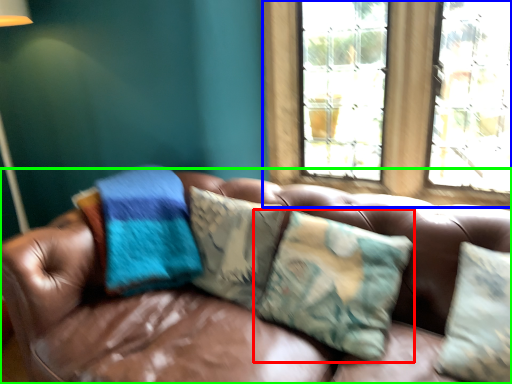
Question: Considering the real-world distances, which object is farthest from pillow (highlighted by a red box)? window (highlighted by a blue box) or studio couch (highlighted by a green box)?

Choices:
 (A) window
 (B) studio couch

Answer: (A)